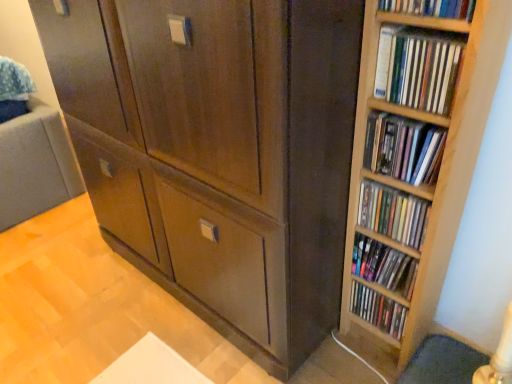
Describe the element at coordinates (384, 265) in the screenshot. I see `matte wooden shelf at right, the fifth book from the top` at that location.

Where is `wooden bookshelf at right, marked as the 2th book in a top-to-bottom arrangement`? This screenshot has height=384, width=512. wooden bookshelf at right, marked as the 2th book in a top-to-bottom arrangement is located at coordinates (418, 67).

You are a GUI agent. You are given a task and a screenshot of the screen. Output one action in this format:
    pyautogui.click(x=<x>, y=<y>)
    Task: Click on the wooden shelves at right, acting as the third book starting from the bottom
    The height and width of the screenshot is (384, 512).
    Given the screenshot: What is the action you would take?
    pyautogui.click(x=393, y=213)

The image size is (512, 384). Identify the location of wooden bookshelf at upper right, arranged as the 1th book when viewed from the top. (431, 8).

Image resolution: width=512 pixels, height=384 pixels. What do you see at coordinates (431, 8) in the screenshot?
I see `wooden bookshelf at upper right, arranged as the 1th book when viewed from the top` at bounding box center [431, 8].

You are a GUI agent. You are given a task and a screenshot of the screen. Output one action in this format:
    pyautogui.click(x=<x>, y=<y>)
    Task: Click on the matte wooden shelf at right, the fifth book from the top
    This screenshot has width=512, height=384.
    Given the screenshot: What is the action you would take?
    pyautogui.click(x=384, y=265)

Is matte brown cabinet at center oriented towards wooden bookshelf at right, marked as the 2th book in a top-to-bottom arrangement?

No, matte brown cabinet at center is not aimed at wooden bookshelf at right, marked as the 2th book in a top-to-bottom arrangement.

Can you confirm if matte brown cabinet at center is bigger than wooden bookshelf at right, which is the fifth book from bottom to top?

Indeed, matte brown cabinet at center has a larger size compared to wooden bookshelf at right, which is the fifth book from bottom to top.

From the image's perspective, which book is the 1st one above the matte brown cabinet at center? Please provide its 2D coordinates.

[(418, 67)]

At what (x,y) coordinates should I click in order to perform the action: click on the 3rd book directly above the wooden shelves at right, the 4th book when ordered from top to bottom (from a real-world perspective). Please return your answer as a coordinate pair (x, y). Looking at the image, I should click on (431, 8).

In the scene shown: Is wooden shelves at right, the 4th book when ordered from top to bottom, outside of wooden bookshelf at upper right, arranged as the 1th book when viewed from the top?

Yes, wooden shelves at right, the 4th book when ordered from top to bottom, is not within wooden bookshelf at upper right, arranged as the 1th book when viewed from the top.

Which of these two, wooden shelves at right, acting as the third book starting from the bottom, or wooden bookshelf at upper right, arranged as the 1th book when viewed from the top, stands shorter?

With less height is wooden bookshelf at upper right, arranged as the 1th book when viewed from the top.

Which is closer to the camera, (374, 212) or (418, 8)?

Clearly, point (374, 212) is more distant from the camera than point (418, 8).

Would you say wooden bookshelf at upper right, arranged as the 1th book when viewed from the top, is inside or outside wooden bookshelf at right, the fourth book positioned from the bottom?

wooden bookshelf at upper right, arranged as the 1th book when viewed from the top, cannot be found inside wooden bookshelf at right, the fourth book positioned from the bottom.

Is wooden bookshelf at upper right, the sixth book positioned from the bottom, directly adjacent to wooden bookshelf at right, the 3th book from the top?

There is a gap between wooden bookshelf at upper right, the sixth book positioned from the bottom, and wooden bookshelf at right, the 3th book from the top.

This screenshot has height=384, width=512. What are the coordinates of `the 2nd book above the wooden bookshelf at right, the fourth book positioned from the bottom (from a real-world perspective)` in the screenshot? It's located at (431, 8).

In the scene shown: Is wooden bookshelf at right, the fourth book positioned from the bottom, placed right next to matte wooden shelf at right, the fifth book from the top?

No.

Can you confirm if wooden bookshelf at right, the 3th book from the top, is positioned to the right of matte wooden shelf at right, the fifth book from the top?

In fact, wooden bookshelf at right, the 3th book from the top, is to the left of matte wooden shelf at right, the fifth book from the top.

From the picture: Can we say wooden bookshelf at right, the 3th book from the top, lies outside matte wooden shelf at right, positioned as the second book in bottom-to-top order?

Yes, wooden bookshelf at right, the 3th book from the top, is outside of matte wooden shelf at right, positioned as the second book in bottom-to-top order.

Based on the photo, is wooden bookshelf at right, the 3th book from the top, in front of matte wooden shelf at right, the fifth book from the top?

Yes, it is in front of matte wooden shelf at right, the fifth book from the top.

Is matte brown cabinet at center shorter than wooden bookshelf at right, the fourth book positioned from the bottom?

In fact, matte brown cabinet at center may be taller than wooden bookshelf at right, the fourth book positioned from the bottom.

From a real-world perspective, between matte brown cabinet at center and wooden bookshelf at right, the fourth book positioned from the bottom, who is vertically lower?

matte brown cabinet at center.

In order to click on cupboard located on the left of wooden bookshelf at right, the 3th book from the top in this screenshot , I will do `click(218, 152)`.

Which of these two, matte brown cabinet at center or wooden bookshelf at right, the 3th book from the top, is smaller?

wooden bookshelf at right, the 3th book from the top, is smaller.

From the image's perspective, is wooden bookshelf at right, marked as the 2th book in a top-to-bottom arrangement, under wooden bookshelf at upper right, arranged as the 1th book when viewed from the top?

Yes.

Locate an element on the screen. the 1st book located beneath the wooden bookshelf at upper right, the sixth book positioned from the bottom (from a real-world perspective) is located at coordinates (418, 67).

Are wooden bookshelf at right, marked as the 2th book in a top-to-bottom arrangement, and wooden bookshelf at upper right, arranged as the 1th book when viewed from the top, far apart?

wooden bookshelf at right, marked as the 2th book in a top-to-bottom arrangement, is actually quite close to wooden bookshelf at upper right, arranged as the 1th book when viewed from the top.

How far apart are wooden bookshelf at right, which is the fifth book from bottom to top, and wooden bookshelf at upper right, arranged as the 1th book when viewed from the top?

A distance of 3.28 inches exists between wooden bookshelf at right, which is the fifth book from bottom to top, and wooden bookshelf at upper right, arranged as the 1th book when viewed from the top.

Is wooden bookshelf at upper right, arranged as the 1th book when viewed from the top, spatially inside wooden bookshelf at right, marked as the 2th book in a top-to-bottom arrangement, or outside of it?

The correct answer is: outside.

From the image's perspective, between wooden bookshelf at upper right, the sixth book positioned from the bottom, and wooden bookshelf at right, marked as the 2th book in a top-to-bottom arrangement, who is located below?

wooden bookshelf at right, marked as the 2th book in a top-to-bottom arrangement, from the image's perspective.

Consider the image. From a real-world perspective, who is located higher, wooden bookshelf at upper right, the sixth book positioned from the bottom, or wooden bookshelf at right, which is the fifth book from bottom to top?

In real-world perspective, wooden bookshelf at upper right, the sixth book positioned from the bottom, is above.

The image size is (512, 384). Identify the location of book on the left of wooden bookshelf at right, which is the fifth book from bottom to top. (431, 8).

Find the location of a particular element. The image size is (512, 384). the 2nd book behind when counting from the matte brown cabinet at center is located at coordinates (418, 67).

Identify the location of the 3rd book to the right of the wooden bookshelf at upper right, arranged as the 1th book when viewed from the top, counting from the anchor's position. (393, 213).

Based on their spatial positions, is wooden bookshelf at right, which is the fifth book from bottom to top, or matte wooden shelf at right, positioned as the second book in bottom-to-top order, closer to wooden bookshelf at right, the 3th book from the top?

wooden bookshelf at right, which is the fifth book from bottom to top, is closer to wooden bookshelf at right, the 3th book from the top.

Considering their positions, is matte wooden shelf at right, positioned as the second book in bottom-to-top order, positioned closer to matte brown cabinet at center than wooden bookshelf at right, marked as the 2th book in a top-to-bottom arrangement?

matte wooden shelf at right, positioned as the second book in bottom-to-top order, lies closer to matte brown cabinet at center than the other object.

Looking at the image, which one is located further to wooden shelves at right, acting as the third book starting from the bottom, wooden bookshelf at right, the fourth book positioned from the bottom, or matte brown cabinet at center?

Among the two, matte brown cabinet at center is located further to wooden shelves at right, acting as the third book starting from the bottom.

Based on their spatial positions, is wooden bookshelf at right, marked as the 2th book in a top-to-bottom arrangement, or multicolored plastic dvds at right, the first book when ordered from bottom to top, closer to matte wooden shelf at right, the fifth book from the top?

multicolored plastic dvds at right, the first book when ordered from bottom to top, is positioned closer to the anchor matte wooden shelf at right, the fifth book from the top.

From the image, which object appears to be farther from wooden bookshelf at right, the 3th book from the top, wooden bookshelf at right, marked as the 2th book in a top-to-bottom arrangement, or multicolored plastic dvds at right, the sixth book in the top-to-bottom sequence?

Based on the image, multicolored plastic dvds at right, the sixth book in the top-to-bottom sequence, appears to be further to wooden bookshelf at right, the 3th book from the top.

Considering their positions, is wooden shelves at right, acting as the third book starting from the bottom, positioned closer to wooden bookshelf at right, marked as the 2th book in a top-to-bottom arrangement, than matte wooden shelf at right, positioned as the second book in bottom-to-top order?

Based on the image, wooden shelves at right, acting as the third book starting from the bottom, appears to be nearer to wooden bookshelf at right, marked as the 2th book in a top-to-bottom arrangement.

Which object lies further to the anchor point wooden bookshelf at right, the 3th book from the top, wooden bookshelf at right, which is the fifth book from bottom to top, or wooden bookshelf at upper right, the sixth book positioned from the bottom?

wooden bookshelf at upper right, the sixth book positioned from the bottom, is positioned further to the anchor wooden bookshelf at right, the 3th book from the top.

Based on their spatial positions, is wooden bookshelf at right, which is the fifth book from bottom to top, or wooden bookshelf at right, the fourth book positioned from the bottom, closer to matte brown cabinet at center?

wooden bookshelf at right, the fourth book positioned from the bottom, is positioned closer to the anchor matte brown cabinet at center.

Where is `book that lies between wooden shelves at right, acting as the third book starting from the bottom, and multicolored plastic dvds at right, the sixth book in the top-to-bottom sequence, from top to bottom`? book that lies between wooden shelves at right, acting as the third book starting from the bottom, and multicolored plastic dvds at right, the sixth book in the top-to-bottom sequence, from top to bottom is located at coordinates (384, 265).

Image resolution: width=512 pixels, height=384 pixels. Find the location of `cupboard between wooden bookshelf at upper right, arranged as the 1th book when viewed from the top, and multicolored plastic dvds at right, the sixth book in the top-to-bottom sequence, from top to bottom`. cupboard between wooden bookshelf at upper right, arranged as the 1th book when viewed from the top, and multicolored plastic dvds at right, the sixth book in the top-to-bottom sequence, from top to bottom is located at coordinates (218, 152).

Identify the location of book that lies between wooden bookshelf at upper right, arranged as the 1th book when viewed from the top, and wooden bookshelf at right, the 3th book from the top, from top to bottom. (418, 67).

Where is `book between wooden bookshelf at right, marked as the 2th book in a top-to-bottom arrangement, and wooden shelves at right, acting as the third book starting from the bottom, in the up-down direction`? Image resolution: width=512 pixels, height=384 pixels. book between wooden bookshelf at right, marked as the 2th book in a top-to-bottom arrangement, and wooden shelves at right, acting as the third book starting from the bottom, in the up-down direction is located at coordinates (403, 148).